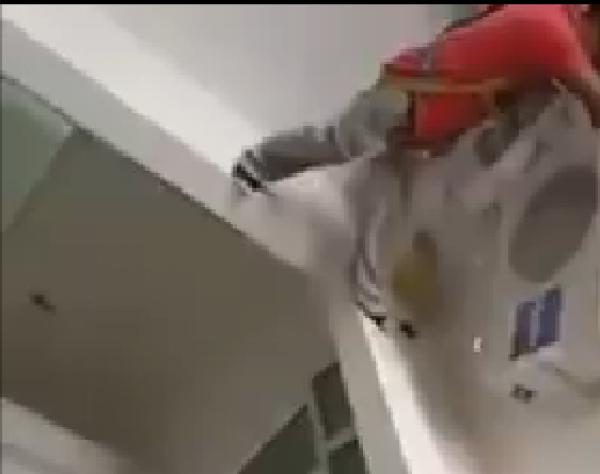
You are a GUI agent. You are given a task and a screenshot of the screen. Output one action in this format:
    pyautogui.click(x=<x>, y=<y>)
    Task: Click on the wall
    Image resolution: width=600 pixels, height=474 pixels.
    Given the screenshot: What is the action you would take?
    pyautogui.click(x=98, y=65)